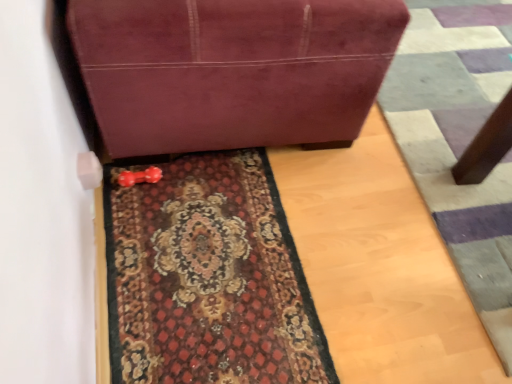
Locate an element on the screen. The height and width of the screenshot is (384, 512). empty space that is ontop of carpeted mat at center is located at coordinates (203, 253).